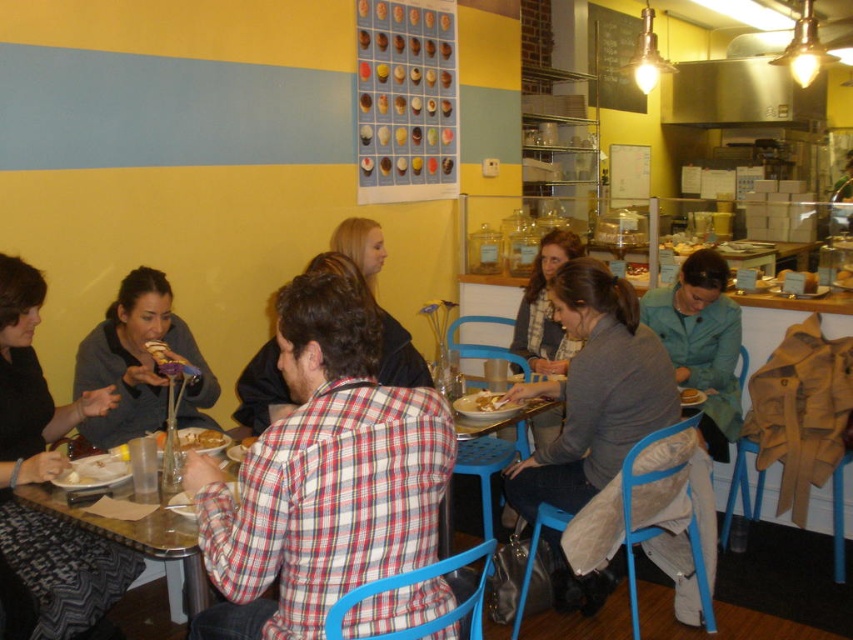
Where is `green fabric jacket at right`? The height and width of the screenshot is (640, 853). green fabric jacket at right is located at coordinates (701, 340).

Is green fabric jacket at right closer to the viewer compared to white matte plate at center?

No.

Which is behind, point (706, 355) or point (456, 404)?

Point (706, 355)

The height and width of the screenshot is (640, 853). What are the coordinates of `green fabric jacket at right` in the screenshot? It's located at (701, 340).

Is metallic silver table at lower left to the right of white matte plate at center from the viewer's perspective?

Incorrect, metallic silver table at lower left is not on the right side of white matte plate at center.

Which of these two, metallic silver table at lower left or white matte plate at center, stands shorter?

With less height is white matte plate at center.

Does point (141, 550) come in front of point (509, 404)?

Yes, point (141, 550) is closer to viewer.

At what (x,y) coordinates should I click in order to perform the action: click on metallic silver table at lower left. Please return your answer as a coordinate pair (x, y). This screenshot has height=640, width=853. Looking at the image, I should click on (135, 536).

What do you see at coordinates (44, 481) in the screenshot? I see `matte black jacket at left` at bounding box center [44, 481].

Between matte black jacket at left and matte gray sweater at left, which one appears on the right side from the viewer's perspective?

matte gray sweater at left

Who is more forward, [97,547] or [86,342]?

Positioned in front is point [97,547].

This screenshot has width=853, height=640. I want to click on matte black jacket at left, so click(44, 481).